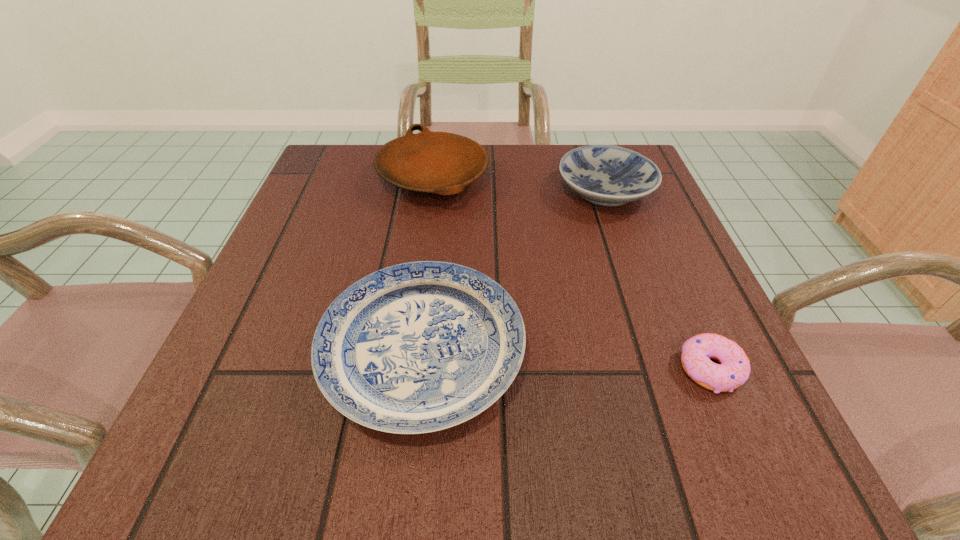
Find the location of a particular element. Image resolution: width=960 pixels, height=540 pixels. the rightmost plate is located at coordinates (607, 175).

Locate an element on the screen. This screenshot has width=960, height=540. the shortest plate is located at coordinates (418, 347).

At what (x,y) coordinates should I click in order to perform the action: click on doughnut. Please return your answer as a coordinate pair (x, y). Image resolution: width=960 pixels, height=540 pixels. Looking at the image, I should click on pos(734,368).

This screenshot has height=540, width=960. I want to click on free space located 0.090m on the front of the rightmost plate, so click(x=626, y=249).

Where is `vacant area situated 0.080m on the right of the shortest plate`? vacant area situated 0.080m on the right of the shortest plate is located at coordinates (576, 350).

Identify the location of vacant point located on the back of the doughnut. (675, 287).

Identify the location of object that is at the near edge. Image resolution: width=960 pixels, height=540 pixels. (418, 347).

Where is `plate situated at the right edge`? plate situated at the right edge is located at coordinates (607, 175).

This screenshot has width=960, height=540. I want to click on doughnut that is at the right edge, so click(x=734, y=368).

Where is `object present at the far left corner`? This screenshot has width=960, height=540. object present at the far left corner is located at coordinates (443, 163).